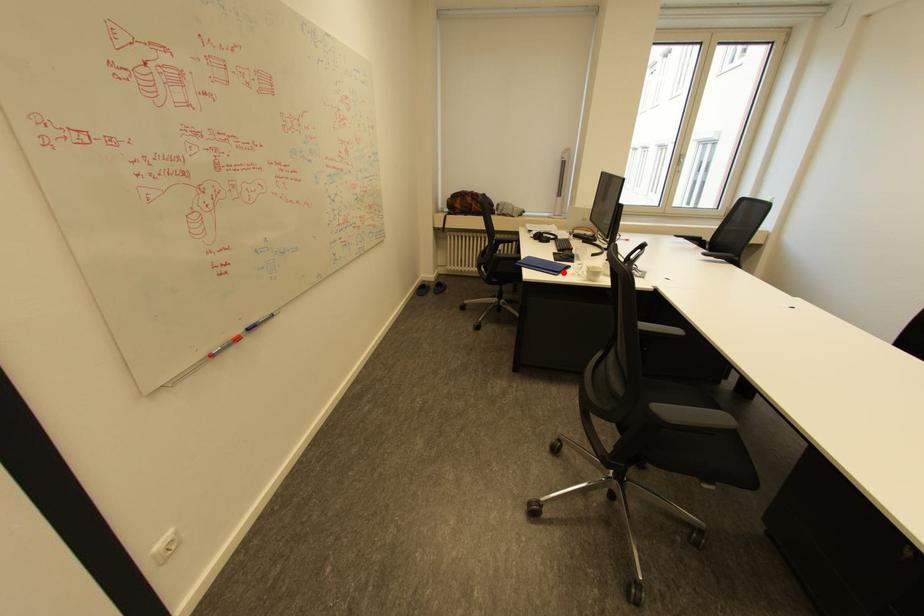
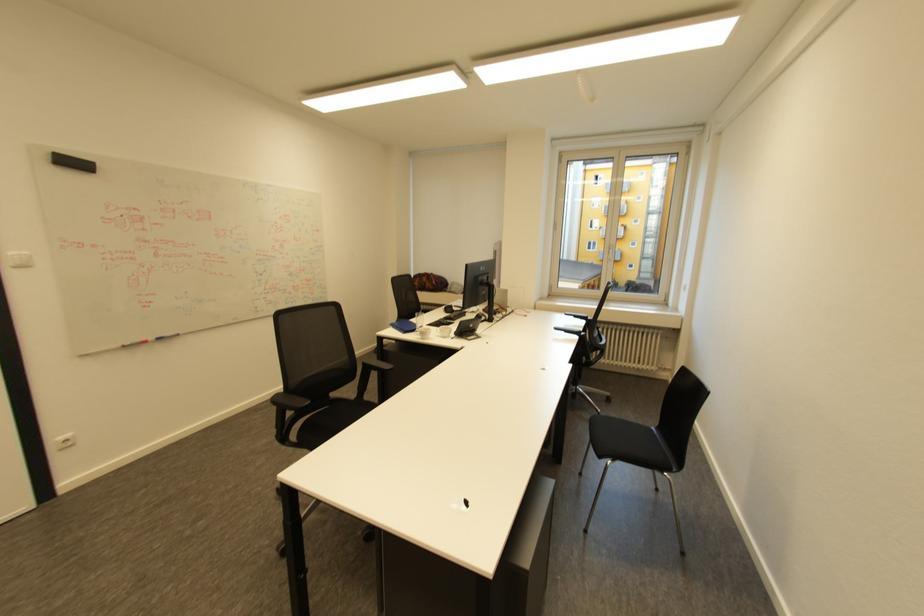
Question: I am providing you with two images of the same scene from different viewpoints. A red point is marked on the first image. Is the red point's position out of view in image 2?

Choices:
 (A) Yes
 (B) No

Answer: (B)